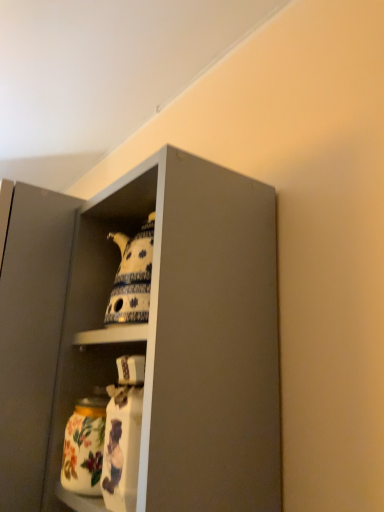
Question: Which direction should I rotate to look at porcelain teapot at upper center, which is counted as the 1th cabinet, starting from the right?

Choices:
 (A) right
 (B) left

Answer: (B)

Question: From a real-world perspective, is porcelain teapot at upper center, which is counted as the 1th cabinet, starting from the right, located beneath matte gray cabinet at upper center?

Choices:
 (A) no
 (B) yes

Answer: (A)

Question: From the image's perspective, does porcelain teapot at upper center, which is counted as the 1th cabinet, starting from the right, appear higher than matte gray cabinet at upper center?

Choices:
 (A) no
 (B) yes

Answer: (B)

Question: Is porcelain teapot at upper center, which is counted as the 1th cabinet, starting from the right, directly adjacent to matte gray cabinet at upper center?

Choices:
 (A) yes
 (B) no

Answer: (A)

Question: Can you confirm if porcelain teapot at upper center, which is counted as the 1th cabinet, starting from the right, is positioned to the right of matte gray cabinet at upper center?

Choices:
 (A) yes
 (B) no

Answer: (B)

Question: Does porcelain teapot at upper center, which is counted as the 1th cabinet, starting from the right, lie behind matte gray cabinet at upper center?

Choices:
 (A) no
 (B) yes

Answer: (B)

Question: Considering the relative sizes of porcelain teapot at upper center, which is the 2th cabinet from left to right, and matte gray cabinet at upper center in the image provided, is porcelain teapot at upper center, which is the 2th cabinet from left to right, bigger than matte gray cabinet at upper center?

Choices:
 (A) no
 (B) yes

Answer: (A)

Question: Is matte gray cabinet at upper center at the right side of porcelain teapot at upper center, which is counted as the 1th cabinet, starting from the right?

Choices:
 (A) no
 (B) yes

Answer: (B)

Question: Are matte gray cabinet at upper center and porcelain teapot at upper center, which is counted as the 1th cabinet, starting from the right, located far from each other?

Choices:
 (A) no
 (B) yes

Answer: (A)

Question: Does matte gray cabinet at upper center turn towards porcelain teapot at upper center, which is counted as the 1th cabinet, starting from the right?

Choices:
 (A) yes
 (B) no

Answer: (A)

Question: Is matte gray cabinet at upper center bigger than porcelain teapot at upper center, which is the 2th cabinet from left to right?

Choices:
 (A) yes
 (B) no

Answer: (A)

Question: Can you confirm if matte gray cabinet at upper center is shorter than porcelain teapot at upper center, which is counted as the 1th cabinet, starting from the right?

Choices:
 (A) no
 (B) yes

Answer: (A)

Question: From the image's perspective, is matte gray cabinet at upper center under porcelain teapot at upper center, which is the 2th cabinet from left to right?

Choices:
 (A) yes
 (B) no

Answer: (A)

Question: Is porcelain teapot at upper center, which is counted as the 1th cabinet, starting from the right, in front of floral ceramic jar at lower left?

Choices:
 (A) no
 (B) yes

Answer: (B)